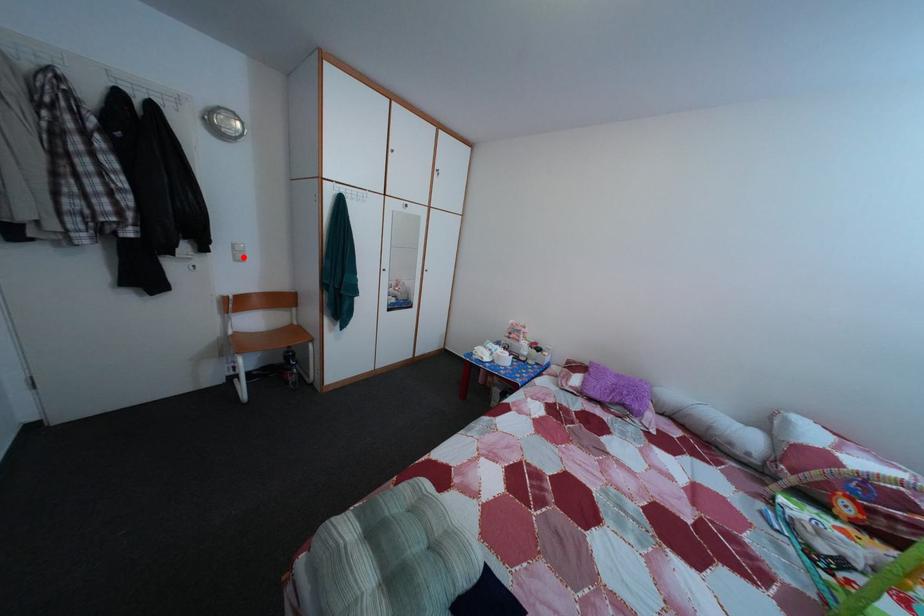
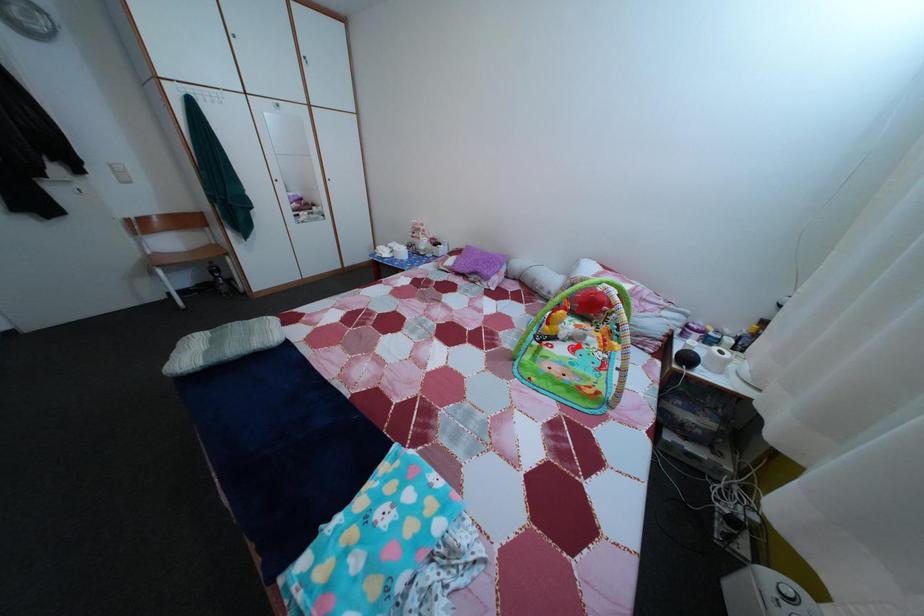
I am providing you with two images of the same scene from different viewpoints. A red point is marked on the first image and another point is marked on the second image. Does the point marked in image1 correspond to the same location as the one in image2?

No